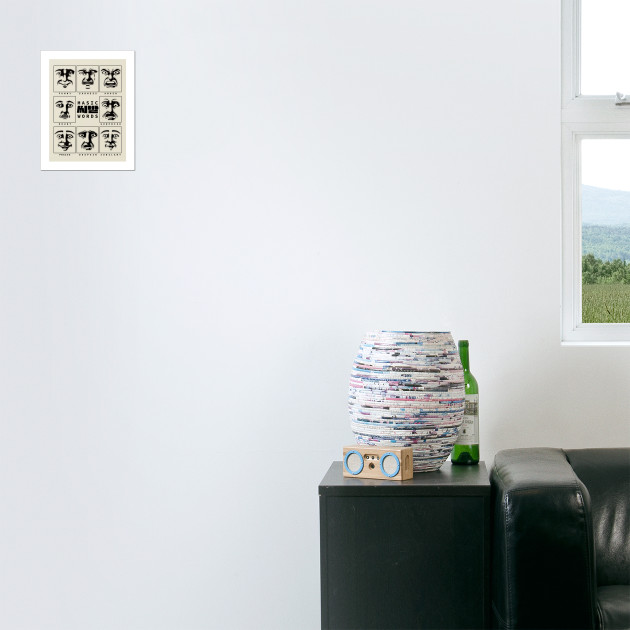
Find the location of a particular element. corners of side table surface is located at coordinates (319, 487), (331, 461), (484, 460), (488, 484).